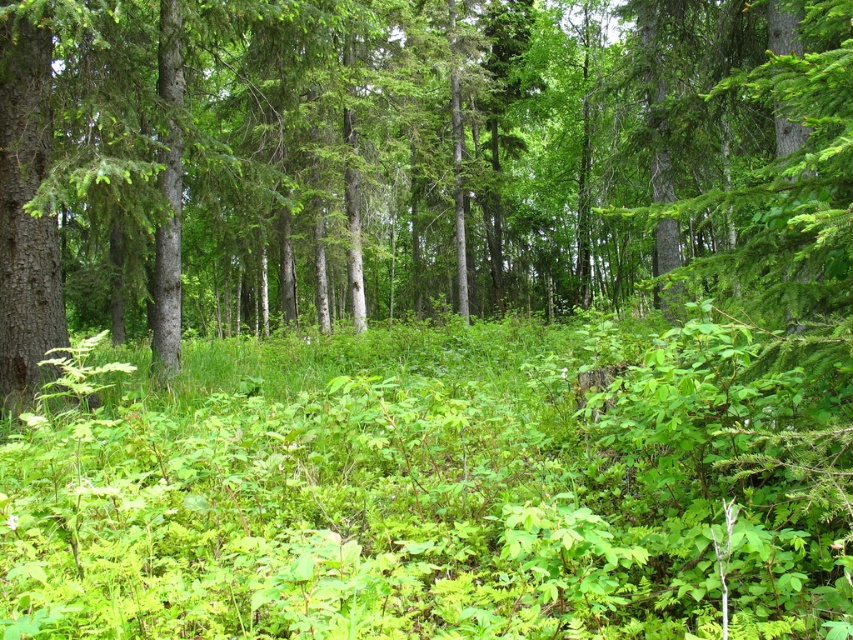
You are standing in the forest and notice two green elements at the center of your view. Which one is nearer to you, the green matte tree at center or the green leafy grass at center?

The green matte tree at center is closer to the viewer than the green leafy grass at center.

You are a hiker standing in the forest and want to take a photo of the green matte tree at center. Your camera has a minimum focusing distance of 2 meters. Can you take a clear photo without moving closer?

The green matte tree at center is 1.75 meters from viewer, which is closer than the camera minimum focusing distance of 2 meters. Therefore, the camera cannot focus clearly on the tree without moving back.